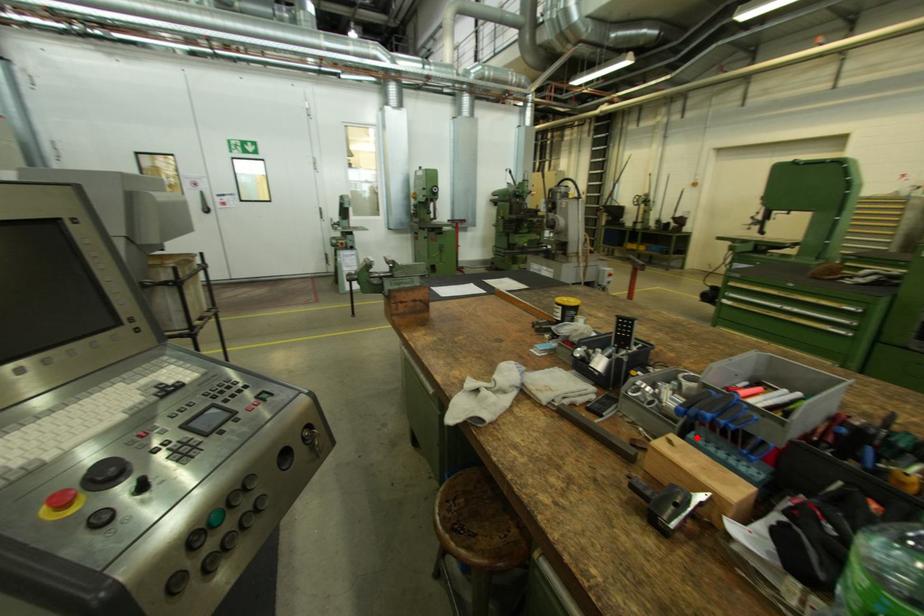
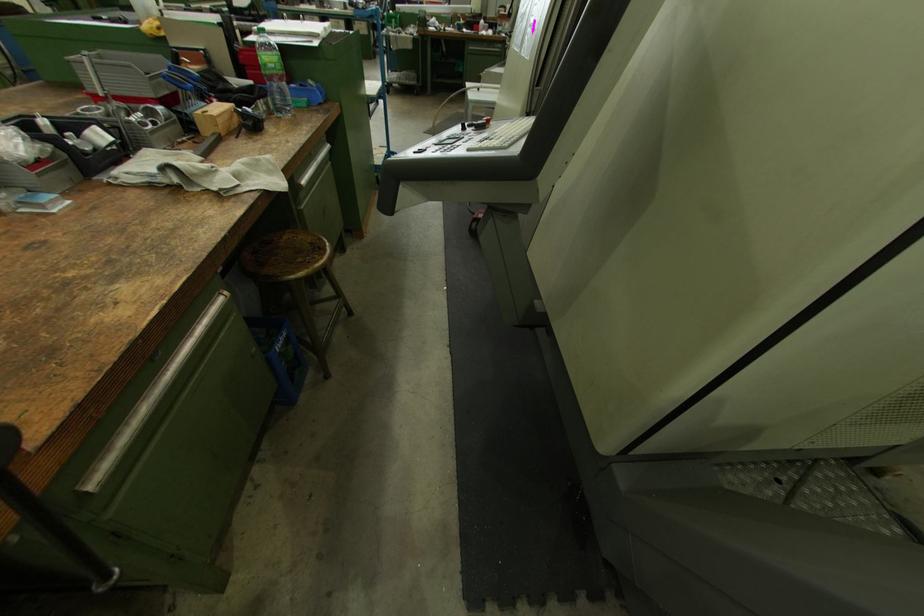
The point at the highlighted location is marked in the first image. Where is the corresponding point in the second image?

(192, 113)